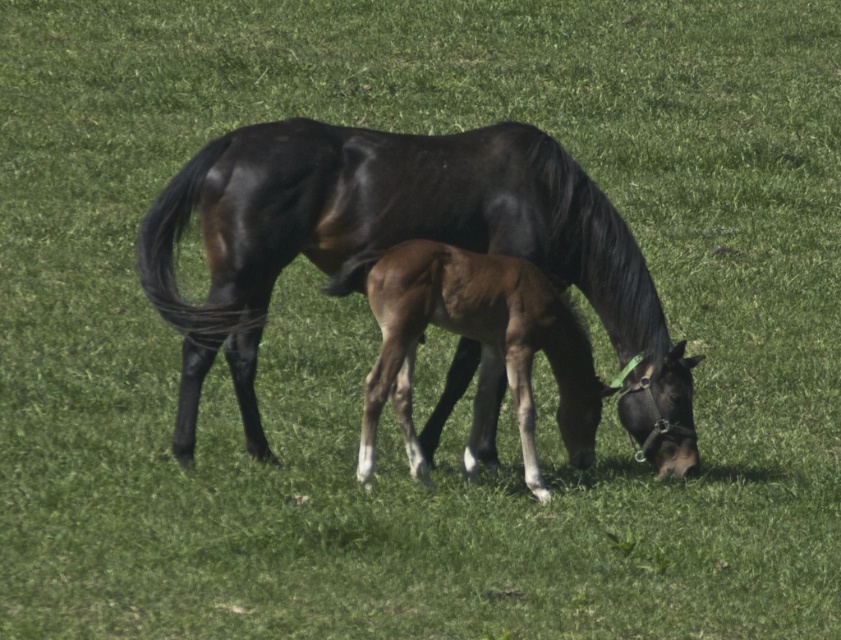
Between shiny black horse at center and brown glossy foal at center, which one has more height?

shiny black horse at center

Describe the element at coordinates (398, 241) in the screenshot. I see `shiny black horse at center` at that location.

What are the coordinates of `shiny black horse at center` in the screenshot? It's located at (398, 241).